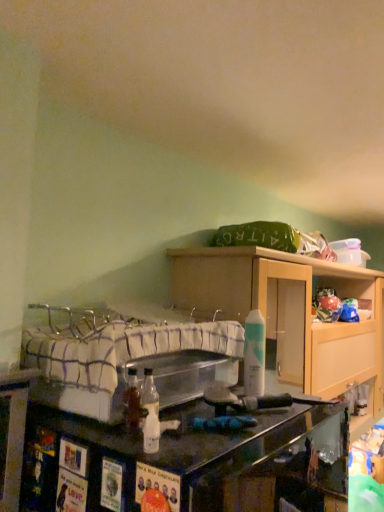
The image size is (384, 512). What do you see at coordinates (254, 355) in the screenshot?
I see `white matte spray can at center` at bounding box center [254, 355].

At what (x,y) coordinates should I click in order to perform the action: click on white matte spray can at center. Please return your answer as a coordinate pair (x, y). The width and height of the screenshot is (384, 512). Looking at the image, I should click on (254, 355).

Locate an element on the screen. The image size is (384, 512). white matte spray can at center is located at coordinates (254, 355).

Which is correct: white matte spray can at center is inside matte wood cabinet at upper center, or outside of it?

white matte spray can at center is outside matte wood cabinet at upper center.

In the scene shown: How much distance is there between white matte spray can at center and matte wood cabinet at upper center?

The distance of white matte spray can at center from matte wood cabinet at upper center is 22.33 inches.

From the image's perspective, is white matte spray can at center on top of matte wood cabinet at upper center?

Yes, from the image's perspective, white matte spray can at center is on top of matte wood cabinet at upper center.

From a real-world perspective, between white matte spray can at center and matte wood cabinet at upper center, who is vertically higher?

In real-world perspective, white matte spray can at center is above.

Which of these two, white matte spray can at center or plaid fabric bed at center, is thinner?

Thinner between the two is white matte spray can at center.

Is white matte spray can at center placed right next to plaid fabric bed at center?

No, white matte spray can at center is not making contact with plaid fabric bed at center.

Who is more distant, white matte spray can at center or plaid fabric bed at center?

Positioned behind is white matte spray can at center.

You are a GUI agent. You are given a task and a screenshot of the screen. Output one action in this format:
    pyautogui.click(x=<x>, y=<y>)
    Task: Click on the bottle behind the plaid fabric bed at center
    The width and height of the screenshot is (384, 512).
    Given the screenshot: What is the action you would take?
    pyautogui.click(x=254, y=355)

Is there a large distance between plaid fabric bed at center and white matte spray can at center?

No.

Is white matte spray can at center located within plaid fabric bed at center?

Yes, white matte spray can at center can be found within plaid fabric bed at center.

Considering their positions, is plaid fabric bed at center located in front of or behind white matte spray can at center?

Visually, plaid fabric bed at center is located in front of white matte spray can at center.

Locate an element on the screen. Image resolution: width=384 pixels, height=512 pixels. bottle above the plaid fabric bed at center (from a real-world perspective) is located at coordinates (254, 355).

The image size is (384, 512). In order to click on cabinetry behind the plaid fabric bed at center in this screenshot , I will do `click(291, 315)`.

Is matte wood cabinet at upper center to the left or to the right of plaid fabric bed at center in the image?

Based on their positions, matte wood cabinet at upper center is located to the right of plaid fabric bed at center.

Does matte wood cabinet at upper center turn towards plaid fabric bed at center?

No.

From a real-world perspective, is matte wood cabinet at upper center positioned under plaid fabric bed at center based on gravity?

Yes.

Could you tell me if matte wood cabinet at upper center is facing white matte spray can at center?

No, matte wood cabinet at upper center is not facing towards white matte spray can at center.

How far apart are matte wood cabinet at upper center and white matte spray can at center?

matte wood cabinet at upper center and white matte spray can at center are 22.33 inches apart.

Which is correct: matte wood cabinet at upper center is inside white matte spray can at center, or outside of it?

matte wood cabinet at upper center cannot be found inside white matte spray can at center.

From a real-world perspective, relative to white matte spray can at center, is matte wood cabinet at upper center vertically above or below?

From a real-world perspective, matte wood cabinet at upper center is physically below white matte spray can at center.

How far apart are plaid fabric bed at center and matte wood cabinet at upper center?

plaid fabric bed at center is 19.93 inches away from matte wood cabinet at upper center.

From the image's perspective, would you say plaid fabric bed at center is positioned over matte wood cabinet at upper center?

Yes, from the image's perspective, plaid fabric bed at center is over matte wood cabinet at upper center.

Would you say plaid fabric bed at center is outside matte wood cabinet at upper center?

That's correct, plaid fabric bed at center is outside of matte wood cabinet at upper center.

Which of these two, plaid fabric bed at center or matte wood cabinet at upper center, is bigger?

matte wood cabinet at upper center is bigger.

Find the location of `bottle above the matte wood cabinet at upper center (from the image's perspective)`. bottle above the matte wood cabinet at upper center (from the image's perspective) is located at coordinates (254, 355).

The image size is (384, 512). I want to click on bed on the left side of white matte spray can at center, so click(124, 358).

Looking at the image, which one is located closer to white matte spray can at center, plaid fabric bed at center or matte wood cabinet at upper center?

plaid fabric bed at center lies closer to white matte spray can at center than the other object.

Consider the image. Looking at the image, which one is located closer to plaid fabric bed at center, matte wood cabinet at upper center or white matte spray can at center?

Based on the image, white matte spray can at center appears to be nearer to plaid fabric bed at center.

When comparing their distances from matte wood cabinet at upper center, does plaid fabric bed at center or white matte spray can at center seem further?

Among the two, white matte spray can at center is located further to matte wood cabinet at upper center.

Based on their spatial positions, is white matte spray can at center or plaid fabric bed at center further from matte wood cabinet at upper center?

Based on the image, white matte spray can at center appears to be further to matte wood cabinet at upper center.

When comparing their distances from plaid fabric bed at center, does white matte spray can at center or matte wood cabinet at upper center seem further?

matte wood cabinet at upper center is further to plaid fabric bed at center.

Looking at the image, which one is located closer to white matte spray can at center, matte wood cabinet at upper center or plaid fabric bed at center?

The object closer to white matte spray can at center is plaid fabric bed at center.

Find the location of a particular element. This screenshot has height=512, width=384. bottle located between plaid fabric bed at center and matte wood cabinet at upper center in the left-right direction is located at coordinates click(254, 355).